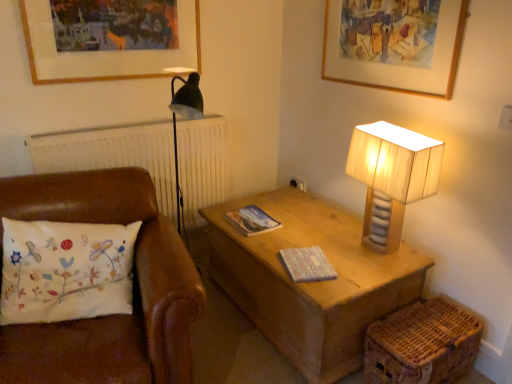
Image resolution: width=512 pixels, height=384 pixels. Find the location of `free location above wooden lampshade at right (from a real-world perspective)`. free location above wooden lampshade at right (from a real-world perspective) is located at coordinates (391, 132).